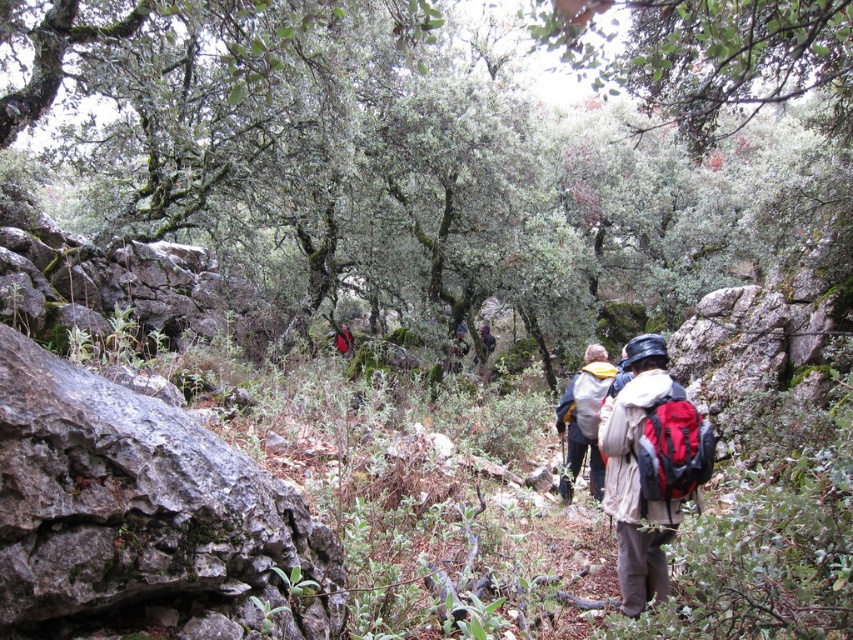
Question: Does red backpack at center have a larger size compared to white fabric backpack at center?

Choices:
 (A) no
 (B) yes

Answer: (B)

Question: Is red backpack at center positioned behind red fabric backpack at center?

Choices:
 (A) no
 (B) yes

Answer: (A)

Question: Which of these objects is positioned farthest from the red fabric backpack at center?

Choices:
 (A) green mossy tree at center
 (B) white fabric backpack at center
 (C) dark blue jacket at center

Answer: (B)

Question: Estimate the real-world distances between objects in this image. Which object is farther from the dark blue jacket at center?

Choices:
 (A) green mossy tree at center
 (B) red backpack at center

Answer: (B)

Question: Can you confirm if white fabric backpack at center is positioned above red fabric backpack at center?

Choices:
 (A) yes
 (B) no

Answer: (B)

Question: Among these points, which one is farthest from the camera?

Choices:
 (A) (496, 273)
 (B) (628, 392)

Answer: (A)